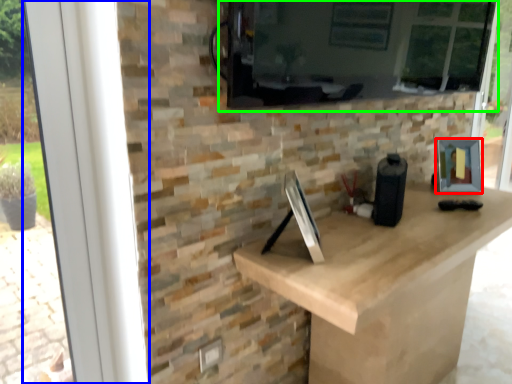
Question: Based on their relative distances, which object is nearer to picture frame (highlighted by a red box)? Choose from window frame (highlighted by a blue box) and window screen (highlighted by a green box).

Choices:
 (A) window frame
 (B) window screen

Answer: (B)